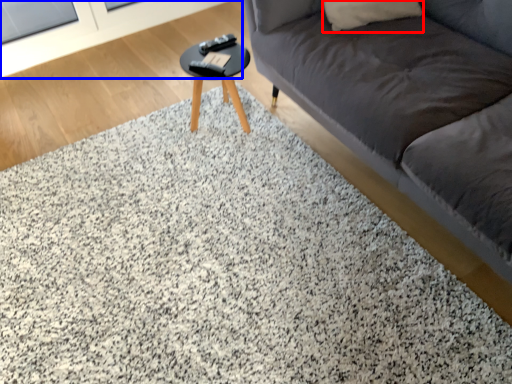
Question: Among these objects, which one is nearest to the camera, pillow (highlighted by a red box) or screen door (highlighted by a blue box)?

Choices:
 (A) pillow
 (B) screen door

Answer: (A)